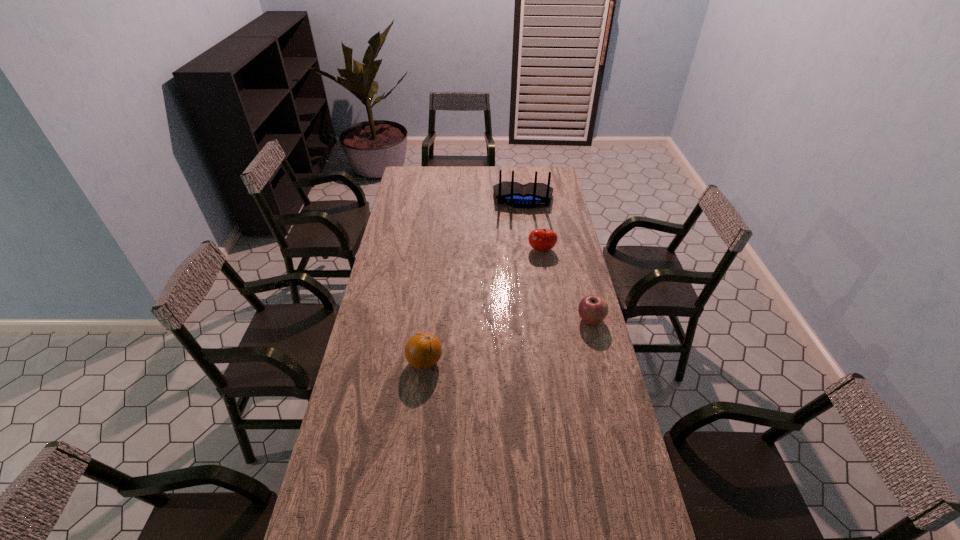
You are a GUI agent. You are given a task and a screenshot of the screen. Output one action in this format:
    pyautogui.click(x=<x>, y=<y>)
    Task: Click on the nearest object
    The image size is (960, 540).
    Given the screenshot: What is the action you would take?
    pyautogui.click(x=423, y=350)

Locate an element on the screen. the leftmost object is located at coordinates (423, 350).

In order to click on the right apple in this screenshot , I will do `click(593, 309)`.

At what (x,y) coordinates should I click in order to perform the action: click on the nearer apple. Please return your answer as a coordinate pair (x, y). Looking at the image, I should click on pyautogui.click(x=593, y=309).

You are a GUI agent. You are given a task and a screenshot of the screen. Output one action in this format:
    pyautogui.click(x=<x>, y=<y>)
    Task: Click on the tallest object
    
    Given the screenshot: What is the action you would take?
    pyautogui.click(x=530, y=195)

Find the location of a particular element. The image size is (960, 540). router is located at coordinates (530, 195).

Locate an element on the screen. the third nearest object is located at coordinates (539, 239).

Identify the location of the left apple. Image resolution: width=960 pixels, height=540 pixels. (539, 239).

Where is `free space located on the left of the orange`? The height and width of the screenshot is (540, 960). free space located on the left of the orange is located at coordinates (365, 362).

The image size is (960, 540). What are the coordinates of `free space located 0.100m on the left of the right apple` in the screenshot? It's located at (551, 320).